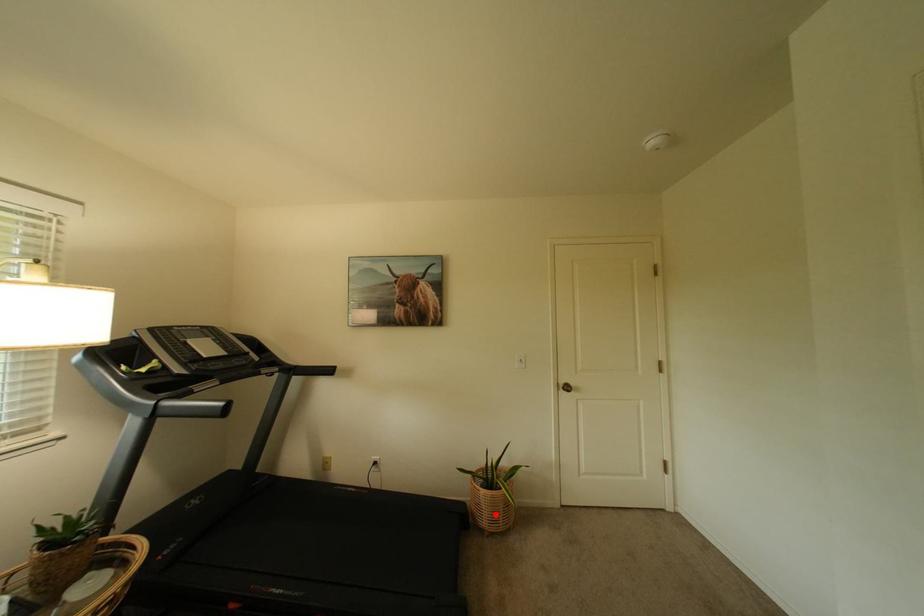
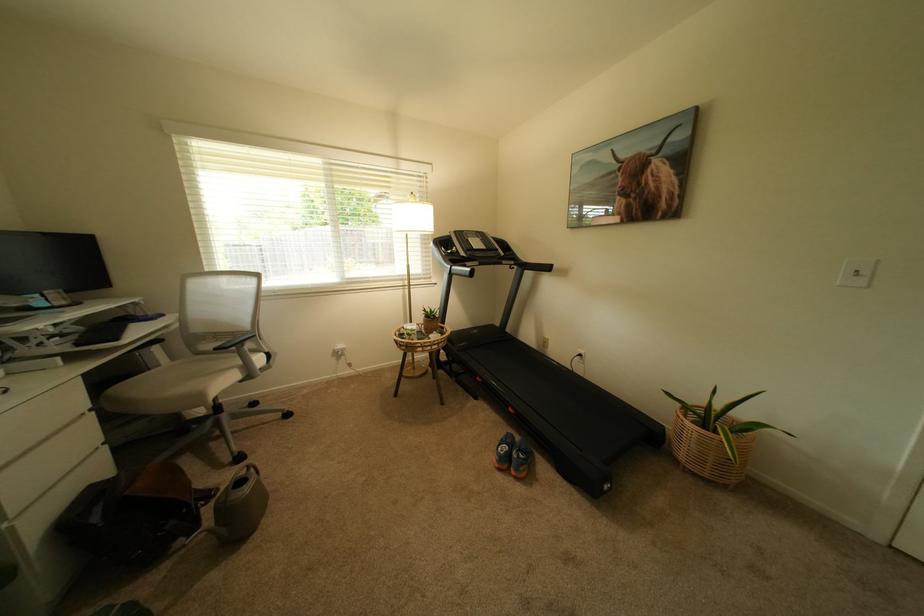
Question: I am providing you with two images of the same scene from different viewpoints. A red point is shown in image1. For the corresponding object point in image2, is it positioned nearer or farther from the camera?

Choices:
 (A) Nearer
 (B) Farther

Answer: (A)